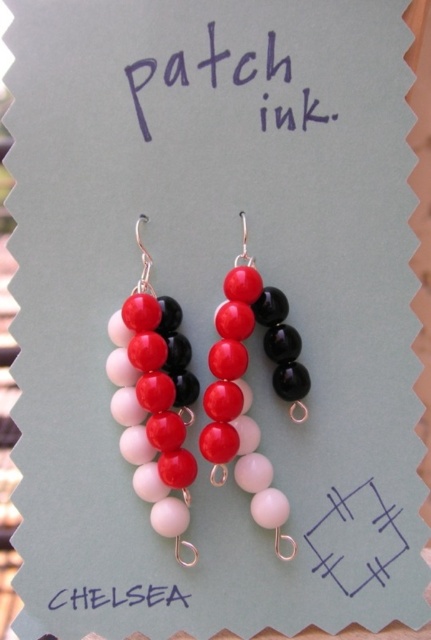
Question: Which point is farther to the camera?

Choices:
 (A) blue ink writing at center
 (B) matte purple text at upper center

Answer: (A)

Question: Can you confirm if matte glass beads at center is thinner than matte purple text at upper center?

Choices:
 (A) no
 (B) yes

Answer: (B)

Question: Which object appears farthest from the camera in this image?

Choices:
 (A) blue ink writing at center
 (B) matte purple text at upper center

Answer: (A)

Question: Can you confirm if shiny glass beads at center is positioned above matte purple text at upper center?

Choices:
 (A) yes
 (B) no

Answer: (B)

Question: Which object appears farthest from the camera in this image?

Choices:
 (A) shiny glass beads at center
 (B) matte glass beads at center
 (C) blue line at center
 (D) blue ink writing at center

Answer: (C)

Question: Is shiny glass beads at center above blue ink writing at center?

Choices:
 (A) no
 (B) yes

Answer: (B)